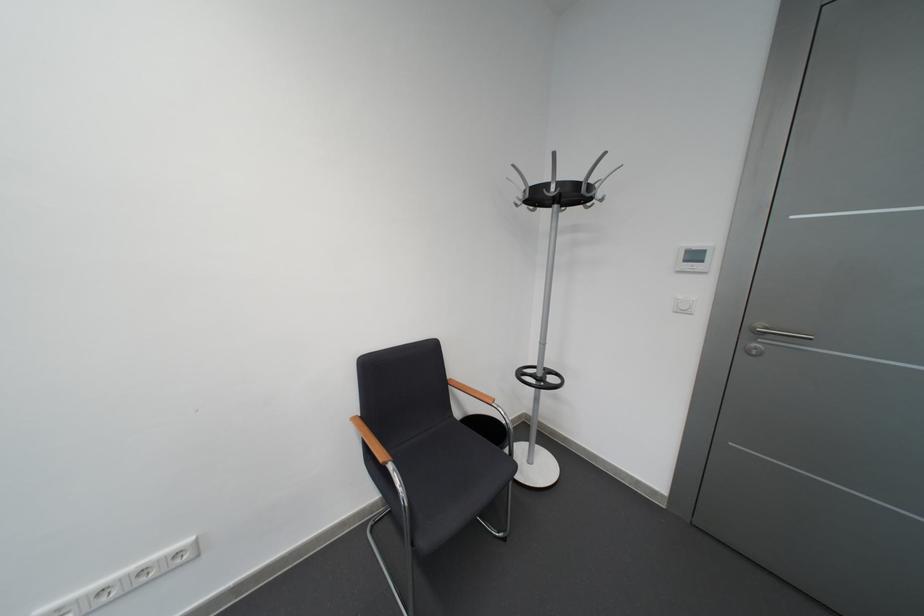
Find the location of a particular element. The image size is (924, 616). black chair sitting surface is located at coordinates (456, 472).